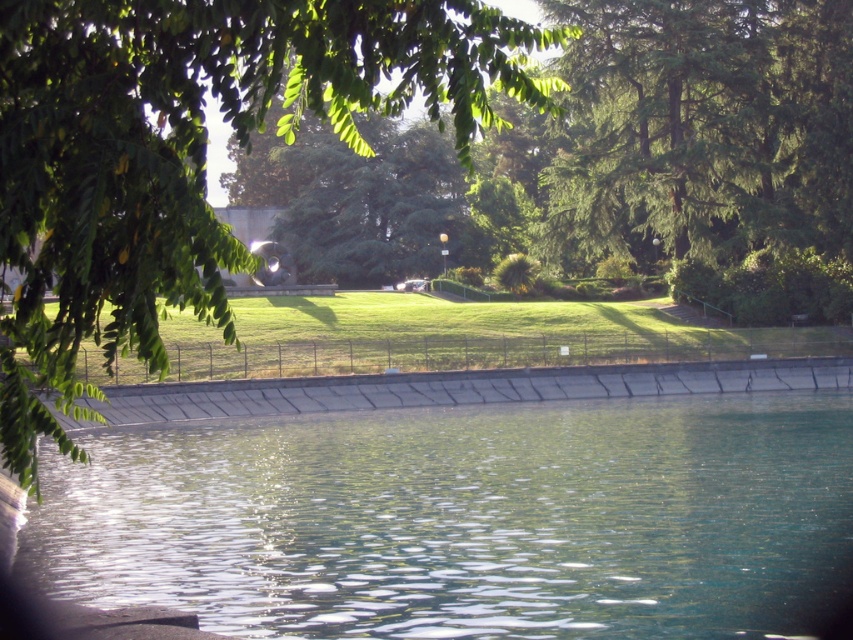
Measure the distance between green leafy tree at upper left and green grass at center.

green leafy tree at upper left is 19.07 meters from green grass at center.

From the picture: Who is more forward, (224,22) or (518,326)?

Point (224,22)

Where is `green leafy tree at upper left`? green leafy tree at upper left is located at coordinates (190, 154).

Which is behind, point (815, 413) or point (306, 346)?

The point (306, 346) is more distant.

Locate an element on the screen. Image resolution: width=853 pixels, height=640 pixels. clear glass water at lower center is located at coordinates (463, 518).

Between clear glass water at lower center and green leafy tree at upper left, which one is positioned higher?

green leafy tree at upper left is above.

Is clear glass water at lower center positioned behind green leafy tree at upper left?

That is True.

The height and width of the screenshot is (640, 853). What do you see at coordinates (463, 518) in the screenshot?
I see `clear glass water at lower center` at bounding box center [463, 518].

This screenshot has width=853, height=640. I want to click on clear glass water at lower center, so click(463, 518).